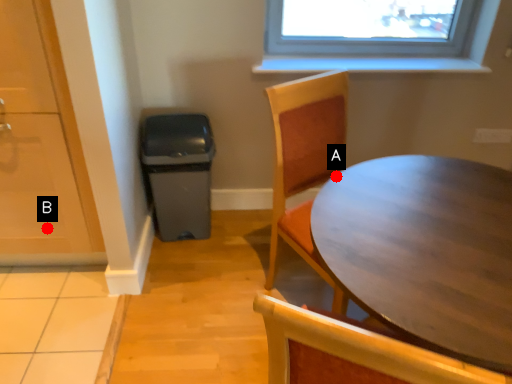
Question: Two points are circled on the image, labeled by A and B beside each circle. Which point is further to the camera?

Choices:
 (A) A is further
 (B) B is further

Answer: (B)